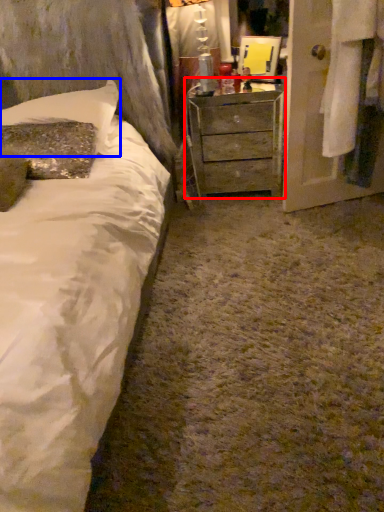
Question: Among these objects, which one is nearest to the camera, chest of drawers (highlighted by a red box) or pillow (highlighted by a blue box)?

Choices:
 (A) chest of drawers
 (B) pillow

Answer: (B)